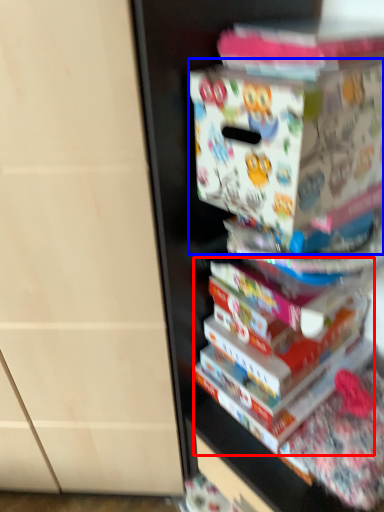
Question: Among these objects, which one is nearest to the camera, book (highlighted by a red box) or paperback book (highlighted by a blue box)?

Choices:
 (A) book
 (B) paperback book

Answer: (B)